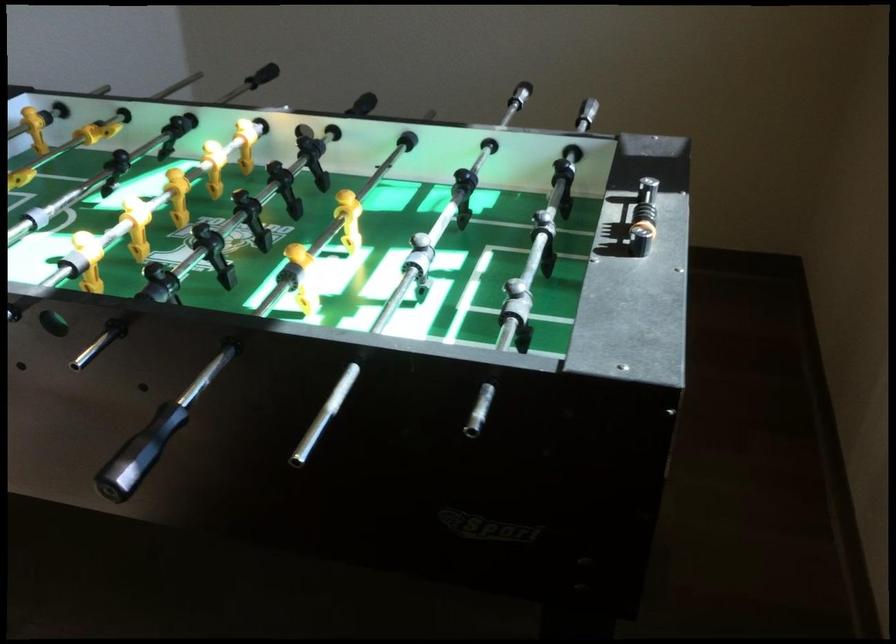
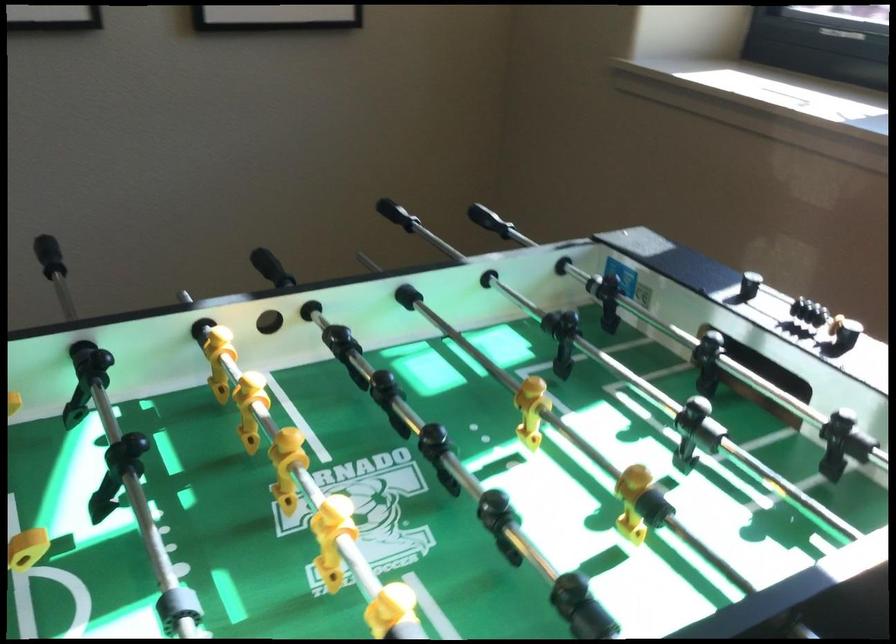
Where in the second image is the point corresponding to pixel 402 102 from the first image?

(48, 256)